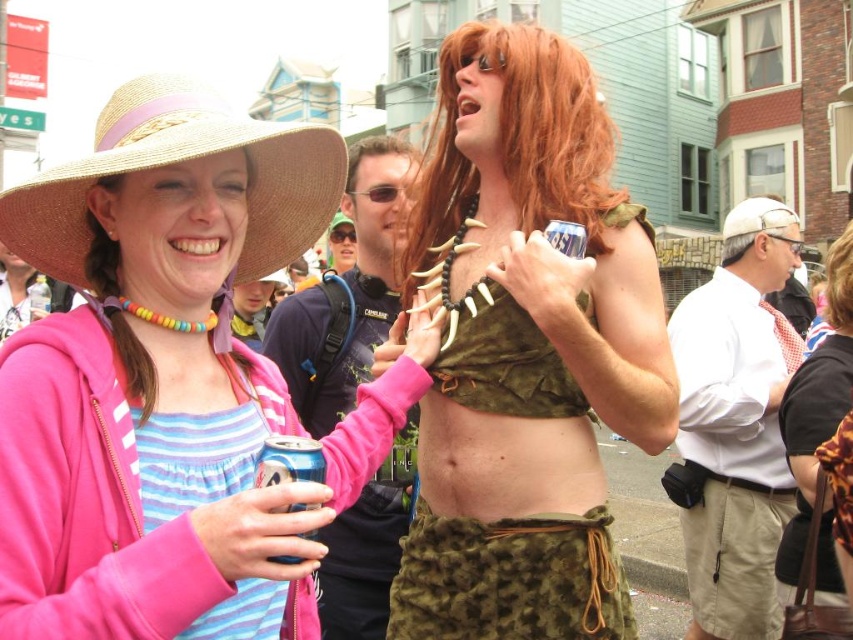
Question: Is blue metallic can at center to the left of brown matte hair at center from the viewer's perspective?

Choices:
 (A) yes
 (B) no

Answer: (B)

Question: Which object is positioned farthest from the fuzzy green skirt at center?

Choices:
 (A) camouflage fabric bikini top at center
 (B) blue metallic can at center
 (C) black plastic goggles at center
 (D) matte straw hat at upper left

Answer: (C)

Question: Which object appears farthest from the camera in this image?

Choices:
 (A) white cotton shirt at center
 (B) brown matte hair at center
 (C) brown straight hair at upper right

Answer: (A)

Question: Considering the real-world distances, which object is farthest from the brown matte hair at center?

Choices:
 (A) blue metallic can at center
 (B) white cotton shirt at center
 (C) reddish-brown wig at upper center

Answer: (B)

Question: Does straw hat at upper left appear on the left side of fuzzy green skirt at center?

Choices:
 (A) yes
 (B) no

Answer: (A)

Question: Does brown leather purse at lower right appear over camouflage fabric bikini top at center?

Choices:
 (A) yes
 (B) no

Answer: (B)